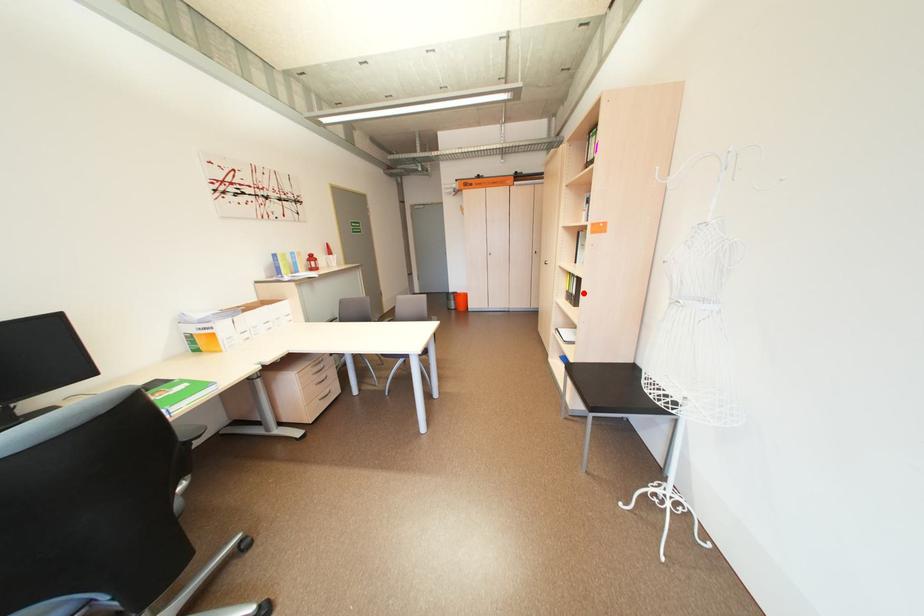
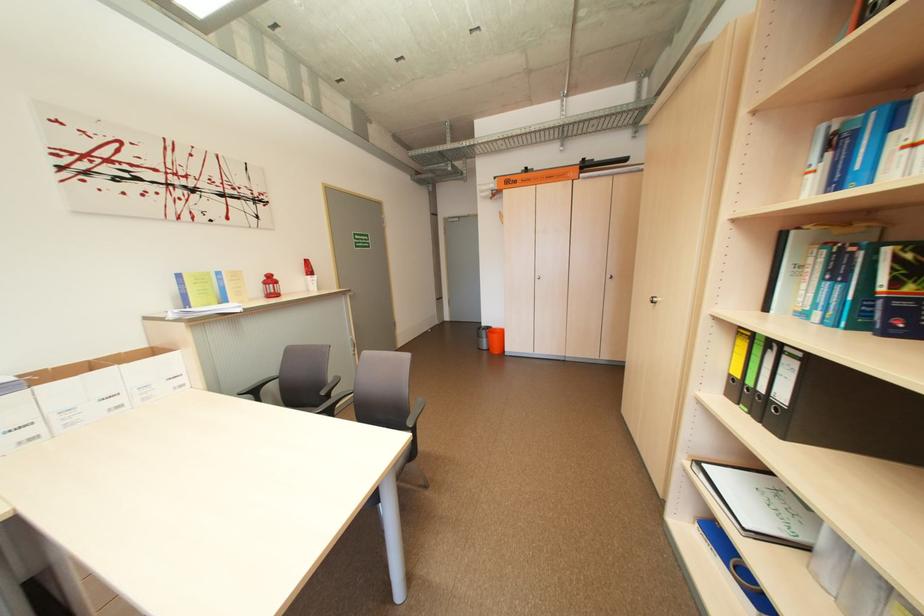
Locate, in the second image, the point that corresponds to the highlighted location in the first image.

(792, 399)